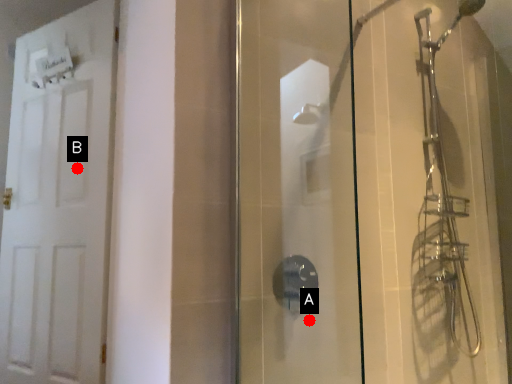
Question: Two points are circled on the image, labeled by A and B beside each circle. Which point appears closest to the camera in this image?

Choices:
 (A) A is closer
 (B) B is closer

Answer: (A)